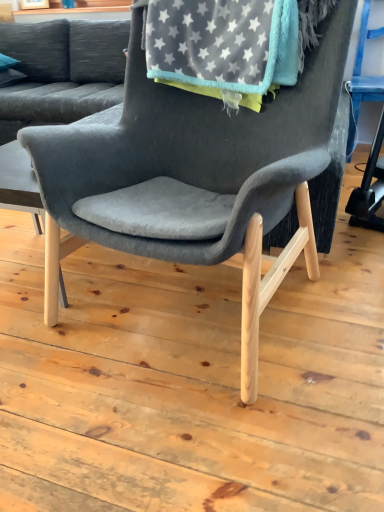
Question: From a real-world perspective, is velvet gray chair at center located higher than gray fleece blanket at upper center?

Choices:
 (A) no
 (B) yes

Answer: (A)

Question: Considering the relative positions of velvet gray chair at center and gray fleece blanket at upper center in the image provided, is velvet gray chair at center to the left of gray fleece blanket at upper center from the viewer's perspective?

Choices:
 (A) no
 (B) yes

Answer: (B)

Question: From the image's perspective, does velvet gray chair at center appear lower than gray fleece blanket at upper center?

Choices:
 (A) yes
 (B) no

Answer: (A)

Question: Is velvet gray chair at center completely or partially outside of gray fleece blanket at upper center?

Choices:
 (A) no
 (B) yes

Answer: (B)

Question: Does velvet gray chair at center have a lesser width compared to gray fleece blanket at upper center?

Choices:
 (A) yes
 (B) no

Answer: (B)

Question: Considering the positions of velvet gray couch at upper left and velvet gray chair at center in the image, is velvet gray couch at upper left bigger or smaller than velvet gray chair at center?

Choices:
 (A) small
 (B) big

Answer: (B)

Question: Is velvet gray couch at upper left situated inside velvet gray chair at center or outside?

Choices:
 (A) outside
 (B) inside

Answer: (A)

Question: From the image's perspective, is velvet gray couch at upper left positioned above or below velvet gray chair at center?

Choices:
 (A) below
 (B) above

Answer: (B)

Question: Is point (31, 55) positioned closer to the camera than point (175, 203)?

Choices:
 (A) farther
 (B) closer

Answer: (A)

Question: From a real-world perspective, relative to light wood table at center, is gray fleece blanket at upper center vertically above or below?

Choices:
 (A) above
 (B) below

Answer: (A)

Question: Is gray fleece blanket at upper center to the left or to the right of light wood table at center in the image?

Choices:
 (A) left
 (B) right

Answer: (B)

Question: Is gray fleece blanket at upper center inside or outside of light wood table at center?

Choices:
 (A) inside
 (B) outside

Answer: (B)

Question: From the image's perspective, is gray fleece blanket at upper center located above or below light wood table at center?

Choices:
 (A) below
 (B) above

Answer: (B)

Question: Looking at their shapes, would you say light wood table at center is wider or thinner than velvet gray chair at center?

Choices:
 (A) wide
 (B) thin

Answer: (B)

Question: From the image's perspective, is light wood table at center positioned above or below velvet gray chair at center?

Choices:
 (A) above
 (B) below

Answer: (B)